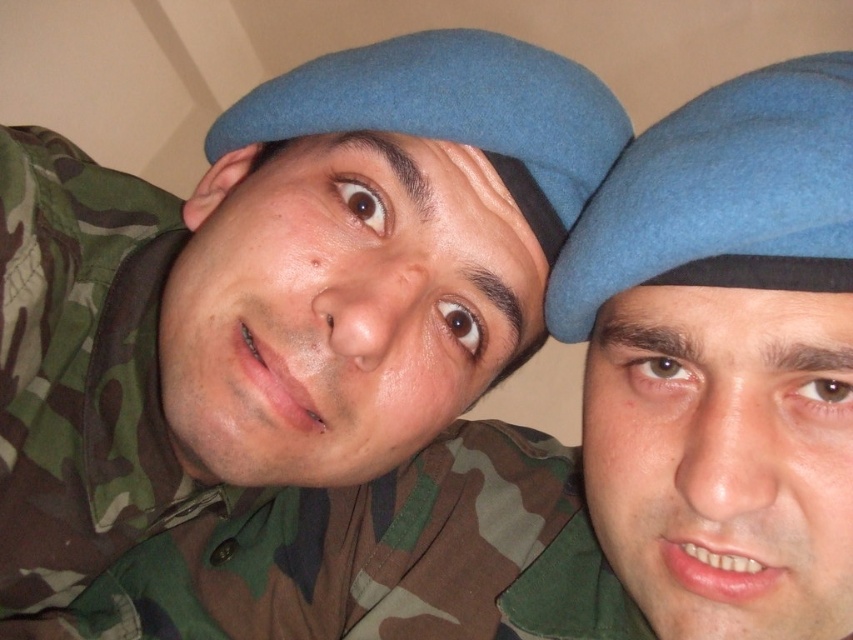
Can you confirm if matte blue beret at upper center is taller than matte blue beret at center?

Correct, matte blue beret at upper center is much taller as matte blue beret at center.

Can you confirm if matte blue beret at upper center is bigger than matte blue beret at center?

Yes, matte blue beret at upper center is bigger than matte blue beret at center.

The height and width of the screenshot is (640, 853). What do you see at coordinates (300, 364) in the screenshot? I see `matte blue beret at upper center` at bounding box center [300, 364].

Identify the location of matte blue beret at upper center. (300, 364).

Is blue felt beret at upper right above matte blue beret at center?

Incorrect, blue felt beret at upper right is not positioned above matte blue beret at center.

Is point (805, 68) farther from camera compared to point (231, 106)?

No, it is in front of (231, 106).

Is point (821, 220) positioned behind point (579, 147)?

No, it is in front of (579, 147).

Find the location of a particular element. This screenshot has width=853, height=640. blue felt beret at upper right is located at coordinates (722, 196).

Which of these two, matte blue beret at upper center or blue felt beret at upper right, stands taller?

matte blue beret at upper center

Image resolution: width=853 pixels, height=640 pixels. Describe the element at coordinates (300, 364) in the screenshot. I see `matte blue beret at upper center` at that location.

What are the coordinates of `matte blue beret at upper center` in the screenshot? It's located at (300, 364).